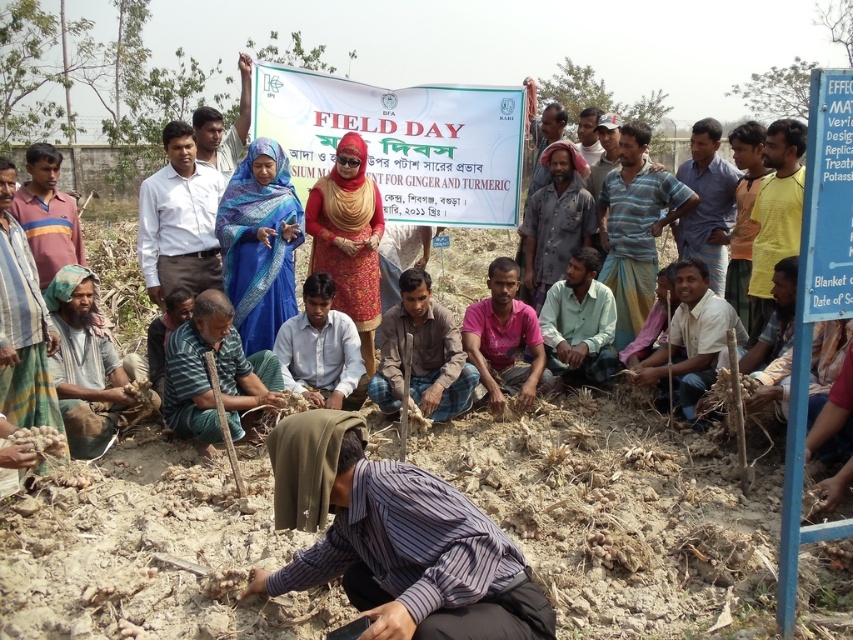
Between red satin dress at center and light green cotton shirt at center, which one appears on the left side from the viewer's perspective?

Positioned to the left is red satin dress at center.

You are a GUI agent. You are given a task and a screenshot of the screen. Output one action in this format:
    pyautogui.click(x=<x>, y=<y>)
    Task: Click on the red satin dress at center
    This screenshot has width=853, height=640.
    Given the screenshot: What is the action you would take?
    pyautogui.click(x=347, y=237)

What are the coordinates of `red satin dress at center` in the screenshot? It's located at (347, 237).

Is purple striped shirt at center shorter than blue printed saree at center?

Correct, purple striped shirt at center is not as tall as blue printed saree at center.

Between point (292, 481) and point (242, 317), which one is positioned in front?

Point (292, 481) is in front.

Is point (405, 604) farther from viewer compared to point (288, 298)?

No, it is not.

Where is `purple striped shirt at center`? purple striped shirt at center is located at coordinates point(393,540).

Consider the image. Which of these two, brown soil at center or light blue shirt at center, stands shorter?

brown soil at center is shorter.

Does brown soil at center have a greater width compared to light blue shirt at center?

Yes, brown soil at center is wider than light blue shirt at center.

Describe the element at coordinates (619, 513) in the screenshot. The width and height of the screenshot is (853, 640). I see `brown soil at center` at that location.

Where is `brown soil at center`? The height and width of the screenshot is (640, 853). brown soil at center is located at coordinates (619, 513).